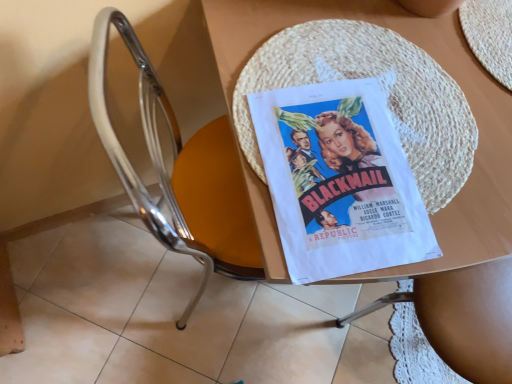
Find the location of a particular element. This screenshot has height=384, width=512. white paper poster at center is located at coordinates (339, 181).

In order to face metallic chrome chair at center, should I rotate leftwards or rightwards?

You should look left and rotate roughly 5.300 degrees.

Identify the location of white paper poster at center. The height and width of the screenshot is (384, 512). (339, 181).

Measure the distance between metallic chrome chair at center and wooden table at center.

They are 15.51 inches apart.

Is metallic chrome chair at center turned away from wooden table at center?

That's right, metallic chrome chair at center is facing away from wooden table at center.

Does metallic chrome chair at center have a greater height compared to wooden table at center?

Correct, metallic chrome chair at center is much taller as wooden table at center.

From a real-world perspective, is wooden table at center positioned over white paper poster at center based on gravity?

No, from a real-world perspective, wooden table at center is not on top of white paper poster at center.

Considering their positions, is wooden table at center located in front of or behind white paper poster at center?

wooden table at center is in front of white paper poster at center.

Who is smaller, wooden table at center or white paper poster at center?

white paper poster at center is smaller.

In the image, is white paper poster at center on the left side or the right side of metallic chrome chair at center?

Clearly, white paper poster at center is on the right of metallic chrome chair at center in the image.

Considering the sizes of objects white paper poster at center and metallic chrome chair at center in the image provided, who is thinner, white paper poster at center or metallic chrome chair at center?

With smaller width is white paper poster at center.

Which of these two, white paper poster at center or metallic chrome chair at center, is bigger?

With larger size is metallic chrome chair at center.

Can you see white paper poster at center touching metallic chrome chair at center?

They are not placed beside each other.

Which object is positioned more to the left, metallic chrome chair at center or white paper poster at center?

Positioned to the left is metallic chrome chair at center.

From their relative heights in the image, would you say metallic chrome chair at center is taller or shorter than white paper poster at center?

In the image, metallic chrome chair at center appears to be taller than white paper poster at center.

Is metallic chrome chair at center facing towards white paper poster at center?

Yes, metallic chrome chair at center is oriented towards white paper poster at center.

Is point (279, 279) more distant than point (216, 216)?

No.

Is wooden table at center next to metallic chrome chair at center?

No, wooden table at center is not next to metallic chrome chair at center.

Which is correct: wooden table at center is inside metallic chrome chair at center, or outside of it?

wooden table at center is spatially situated outside metallic chrome chair at center.

Does wooden table at center have a smaller size compared to metallic chrome chair at center?

Actually, wooden table at center might be larger than metallic chrome chair at center.

From the image's perspective, between white paper poster at center and wooden table at center, which one is located above?

wooden table at center.

Choose the correct answer: Is white paper poster at center inside wooden table at center or outside it?

white paper poster at center is inside wooden table at center.

Is white paper poster at center placed right next to wooden table at center?

Yes.

Where is `table behind the metallic chrome chair at center`? The width and height of the screenshot is (512, 384). table behind the metallic chrome chair at center is located at coordinates (448, 204).

Image resolution: width=512 pixels, height=384 pixels. Identify the location of comic book to the left of wooden table at center. click(x=339, y=181).

Looking at the image, which one is located further to metallic chrome chair at center, wooden table at center or white paper poster at center?

The object further to metallic chrome chair at center is wooden table at center.

When comparing their distances from metallic chrome chair at center, does white paper poster at center or wooden table at center seem further?

wooden table at center.

From the picture: Based on their spatial positions, is white paper poster at center or metallic chrome chair at center further from wooden table at center?

The object further to wooden table at center is metallic chrome chair at center.

Which object lies nearer to the anchor point wooden table at center, metallic chrome chair at center or white paper poster at center?

white paper poster at center is positioned closer to the anchor wooden table at center.

Which object lies further to the anchor point white paper poster at center, metallic chrome chair at center or wooden table at center?

metallic chrome chair at center lies further to white paper poster at center than the other object.

Based on their spatial positions, is wooden table at center or metallic chrome chair at center further from white paper poster at center?

metallic chrome chair at center lies further to white paper poster at center than the other object.

Locate an element on the screen. comic book between metallic chrome chair at center and wooden table at center in the horizontal direction is located at coordinates (339, 181).